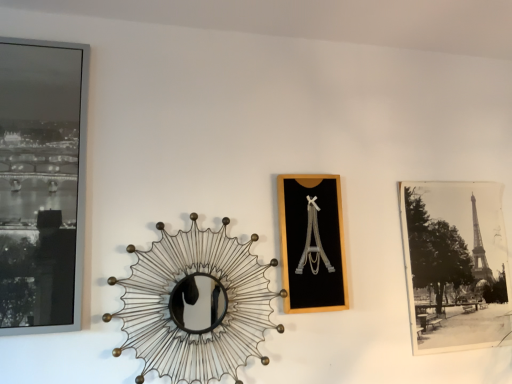
Question: Is metallic wire sunburst mirror at center located outside black paper photo at right, which is the 3th picture frame from front to back?

Choices:
 (A) yes
 (B) no

Answer: (A)

Question: Is the position of metallic wire sunburst mirror at center more distant than that of black paper photo at right, which is the 3th picture frame from front to back?

Choices:
 (A) yes
 (B) no

Answer: (B)

Question: Is metallic wire sunburst mirror at center oriented away from black paper photo at right, which is the 1th picture frame in back-to-front order?

Choices:
 (A) yes
 (B) no

Answer: (B)

Question: Is black paper photo at right, which is the 3th picture frame from front to back, a part of metallic wire sunburst mirror at center?

Choices:
 (A) yes
 (B) no

Answer: (B)

Question: Considering the relative sizes of metallic wire sunburst mirror at center and black paper photo at right, which is the 1th picture frame in back-to-front order, in the image provided, is metallic wire sunburst mirror at center smaller than black paper photo at right, which is the 1th picture frame in back-to-front order,?

Choices:
 (A) yes
 (B) no

Answer: (B)

Question: From the image's perspective, relative to matte black frame at left, the third picture frame in the back-to-front sequence, is black matte picture frame at center, positioned as the 2th picture frame in left-to-right order, above or below?

Choices:
 (A) below
 (B) above

Answer: (A)

Question: Which is correct: black matte picture frame at center, which appears as the 2th picture frame when viewed from the front, is inside matte black frame at left, the 1th picture frame when ordered from left to right, or outside of it?

Choices:
 (A) outside
 (B) inside

Answer: (A)

Question: From a real-world perspective, is black matte picture frame at center, which appears as the 2th picture frame when viewed from the front, physically located above or below matte black frame at left, the 1th picture frame from the front?

Choices:
 (A) below
 (B) above

Answer: (A)

Question: Looking at the image, does black matte picture frame at center, positioned as the 2th picture frame in left-to-right order, seem bigger or smaller compared to matte black frame at left, the third picture frame in the back-to-front sequence?

Choices:
 (A) small
 (B) big

Answer: (A)

Question: In terms of size, does metallic wire sunburst mirror at center appear bigger or smaller than matte black frame at left, the third picture frame in the back-to-front sequence?

Choices:
 (A) big
 (B) small

Answer: (A)

Question: In terms of height, does metallic wire sunburst mirror at center look taller or shorter compared to matte black frame at left, the 1th picture frame from the front?

Choices:
 (A) short
 (B) tall

Answer: (A)

Question: Looking at their shapes, would you say metallic wire sunburst mirror at center is wider or thinner than matte black frame at left, the third picture frame in the back-to-front sequence?

Choices:
 (A) wide
 (B) thin

Answer: (A)

Question: Does point (153, 258) appear closer or farther from the camera than point (53, 72)?

Choices:
 (A) farther
 (B) closer

Answer: (A)

Question: Considering the positions of black paper photo at right, which is the 3th picture frame from front to back, and metallic wire sunburst mirror at center in the image, is black paper photo at right, which is the 3th picture frame from front to back, wider or thinner than metallic wire sunburst mirror at center?

Choices:
 (A) thin
 (B) wide

Answer: (A)

Question: Which is correct: black paper photo at right, which is the 3th picture frame from front to back, is inside metallic wire sunburst mirror at center, or outside of it?

Choices:
 (A) inside
 (B) outside

Answer: (B)